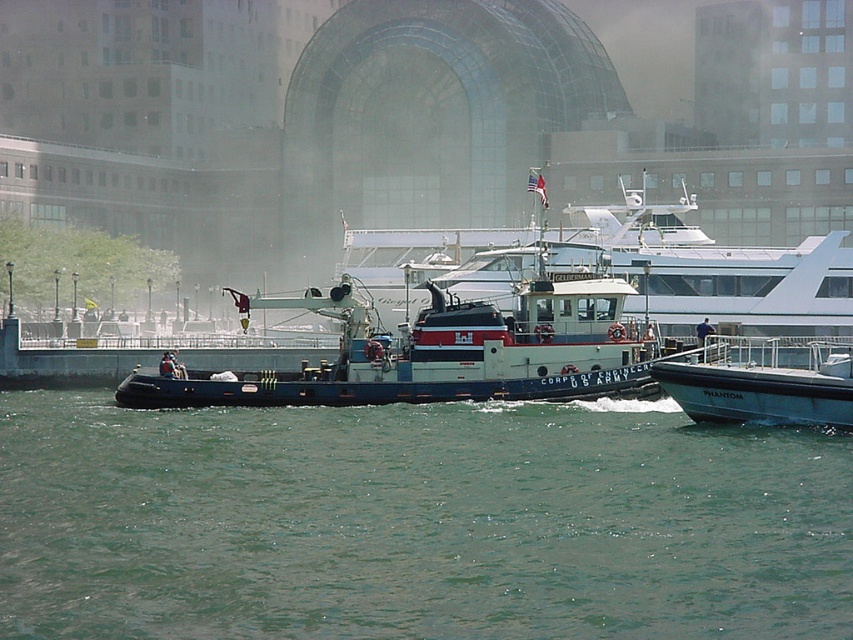
Is point (641, 259) more distant than point (695, 376)?

Yes, it is behind point (695, 376).

How much distance is there between white glossy tugboat at center and white matte boat at right?

A distance of 46.88 feet exists between white glossy tugboat at center and white matte boat at right.

Where is `white glossy tugboat at center`? white glossy tugboat at center is located at coordinates (706, 269).

The height and width of the screenshot is (640, 853). I want to click on white glossy tugboat at center, so click(706, 269).

Which of these two, greenish water at center or white matte boat at right, stands taller?

With more height is white matte boat at right.

Does greenish water at center have a greater height compared to white matte boat at right?

In fact, greenish water at center may be shorter than white matte boat at right.

Locate an element on the screen. This screenshot has width=853, height=640. greenish water at center is located at coordinates (416, 522).

Which is more to the right, blue matte tugboat at center or white matte boat at right?

white matte boat at right is more to the right.

Does blue matte tugboat at center come behind white matte boat at right?

Yes, blue matte tugboat at center is further from the viewer.

Which is behind, point (596, 305) or point (672, 371)?

The point (596, 305) is behind.

Where is `blue matte tugboat at center`? blue matte tugboat at center is located at coordinates 437,353.